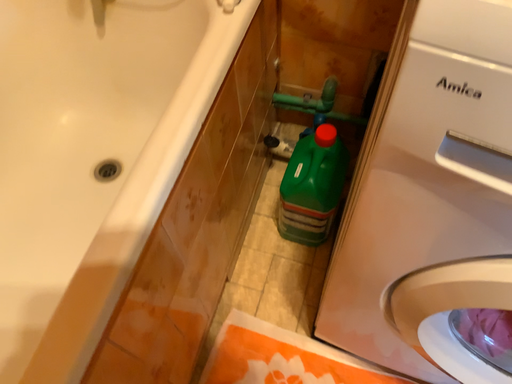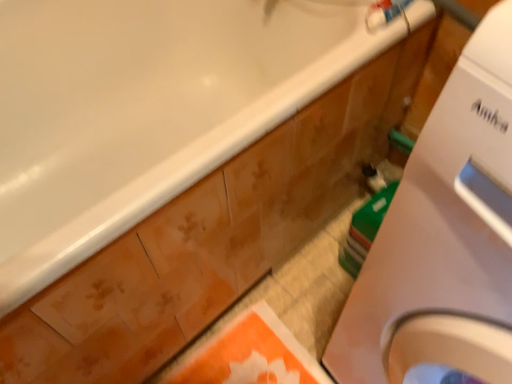
Question: Which way did the camera rotate in the video?

Choices:
 (A) rotated left
 (B) rotated right

Answer: (A)